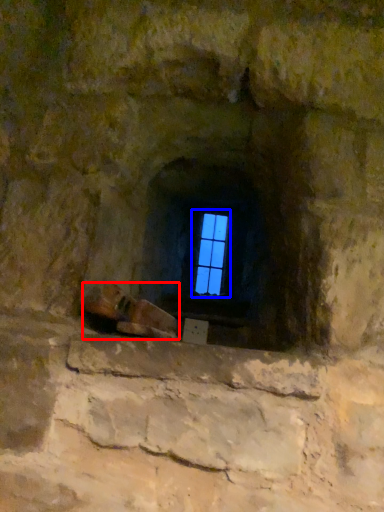
Question: Among these objects, which one is farthest to the camera, footwear (highlighted by a red box) or window (highlighted by a blue box)?

Choices:
 (A) footwear
 (B) window

Answer: (B)